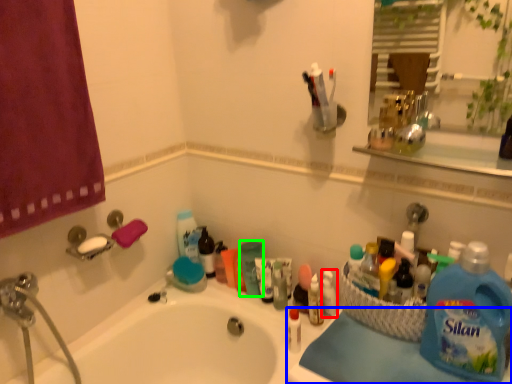
Question: Based on their relative distances, which object is farther from toiletry (highlighted by a red box)? Choose from counter top (highlighted by a blue box) and cleaning product (highlighted by a green box).

Choices:
 (A) counter top
 (B) cleaning product

Answer: (A)